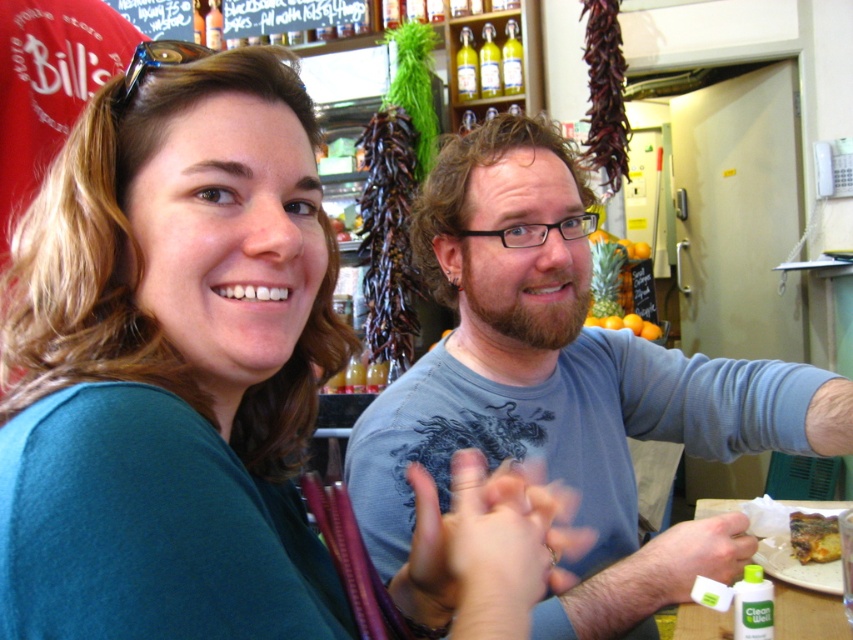
Is teal fabric shirt at upper left bigger than white paper plate at lower right?

Yes, teal fabric shirt at upper left is bigger than white paper plate at lower right.

The image size is (853, 640). What do you see at coordinates (170, 365) in the screenshot? I see `teal fabric shirt at upper left` at bounding box center [170, 365].

The height and width of the screenshot is (640, 853). In order to click on teal fabric shirt at upper left in this screenshot , I will do click(170, 365).

Which is below, green matte bottle at lower right or white paper plate at lower right?

Positioned lower is white paper plate at lower right.

Does point (711, 518) come in front of point (709, 628)?

Yes, it is.

Locate an element on the screen. green matte bottle at lower right is located at coordinates (692, 557).

Does green matte bottle at lower right have a lesser width compared to blue reflective sunglasses at upper left?

In fact, green matte bottle at lower right might be wider than blue reflective sunglasses at upper left.

Identify the location of green matte bottle at lower right. This screenshot has height=640, width=853. (692, 557).

I want to click on green matte bottle at lower right, so click(x=692, y=557).

This screenshot has height=640, width=853. Find the location of `green matte bottle at lower right`. green matte bottle at lower right is located at coordinates (692, 557).